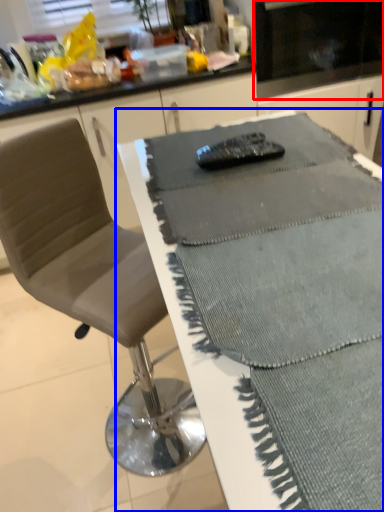
Question: Which of the following is the closest to the observer, appliance (highlighted by a red box) or table (highlighted by a blue box)?

Choices:
 (A) appliance
 (B) table

Answer: (B)